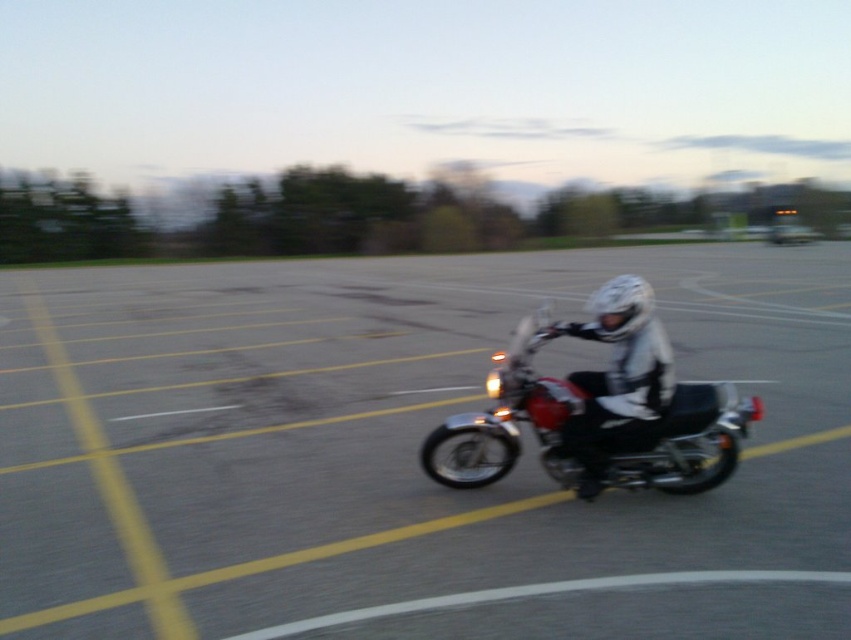
Question: Is gray asphalt parking lot at center to the right of white matte helmet at center from the viewer's perspective?

Choices:
 (A) no
 (B) yes

Answer: (A)

Question: Which object appears farthest from the camera in this image?

Choices:
 (A) shiny chrome motorcycle at center
 (B) white matte helmet at center
 (C) white matte helmet at upper center
 (D) gray asphalt parking lot at center

Answer: (B)

Question: Considering the real-world distances, which object is closest to the shiny chrome motorcycle at center?

Choices:
 (A) white matte helmet at upper center
 (B) gray asphalt parking lot at center

Answer: (A)

Question: Does gray asphalt parking lot at center appear on the right side of white matte helmet at upper center?

Choices:
 (A) no
 (B) yes

Answer: (A)

Question: From the image, what is the correct spatial relationship of gray asphalt parking lot at center in relation to white matte helmet at center?

Choices:
 (A) right
 (B) left

Answer: (B)

Question: Which is farther from the white matte helmet at center?

Choices:
 (A) shiny chrome motorcycle at center
 (B) gray asphalt parking lot at center
 (C) white matte helmet at upper center

Answer: (B)